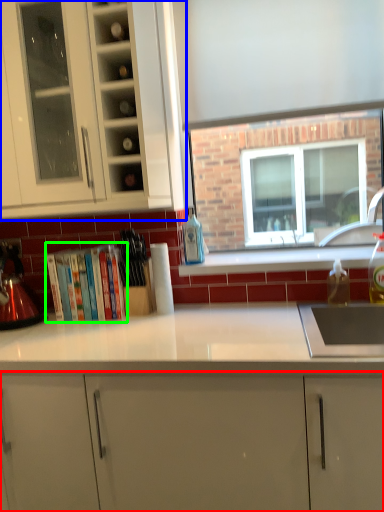
Question: Estimate the real-world distances between objects in this image. Which object is farther from cabinetry (highlighted by a red box), cabinetry (highlighted by a blue box) or book (highlighted by a green box)?

Choices:
 (A) cabinetry
 (B) book

Answer: (A)